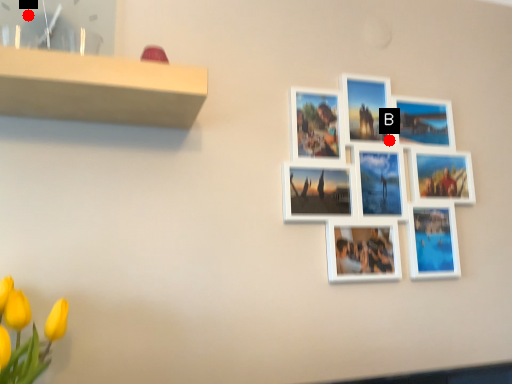
Question: Two points are circled on the image, labeled by A and B beside each circle. Which point is closer to the camera?

Choices:
 (A) A is closer
 (B) B is closer

Answer: (A)